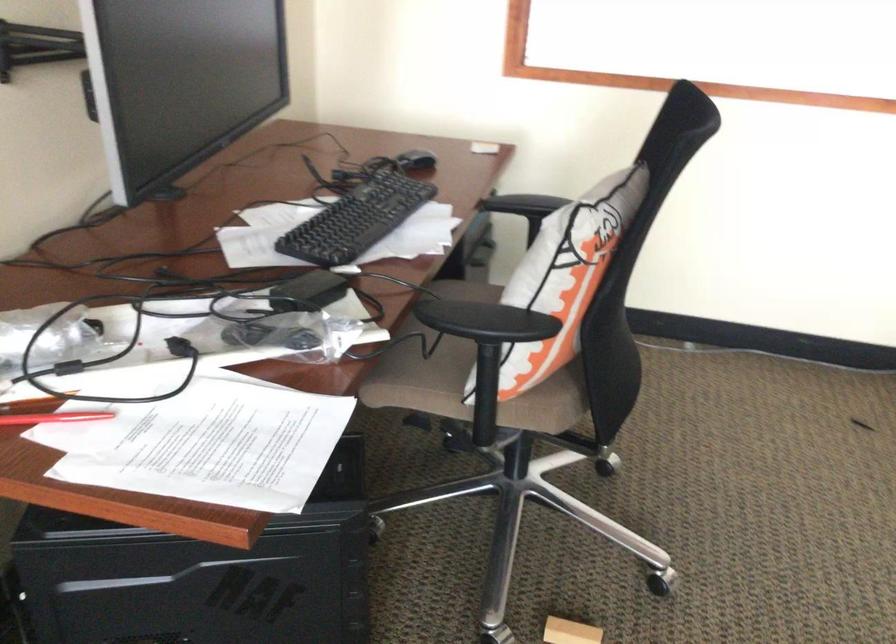
I want to click on chair sitting surface, so click(543, 408).